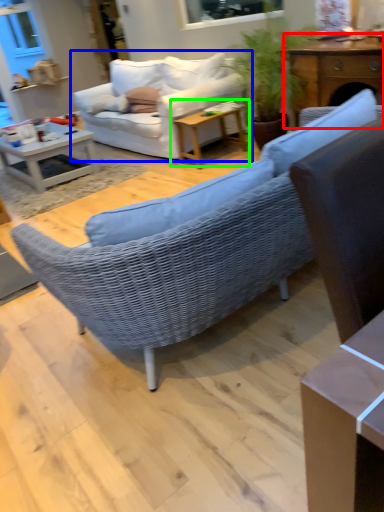
Question: Which is farther away from table (highlighted by a red box)? studio couch (highlighted by a blue box) or table (highlighted by a green box)?

Choices:
 (A) studio couch
 (B) table

Answer: (A)